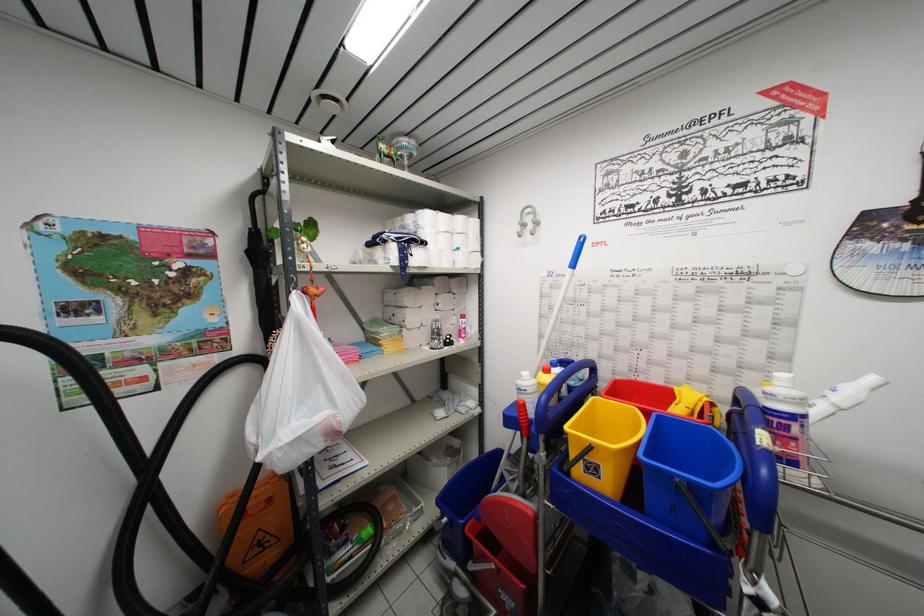
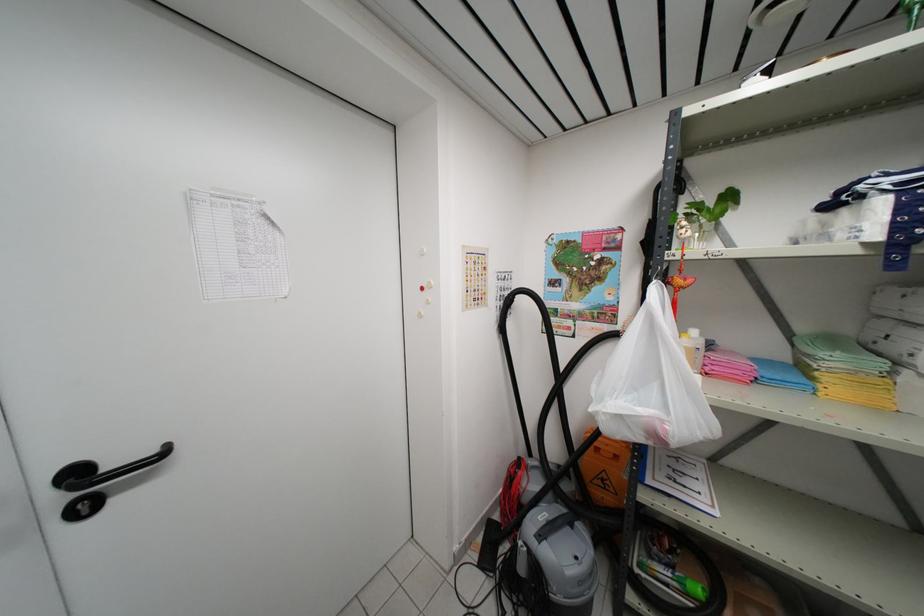
Question: Based on the continuous images, in which direction is the camera rotating? Reply with the corresponding letter.

Choices:
 (A) Left
 (B) Right
 (C) Up
 (D) Down

Answer: (A)